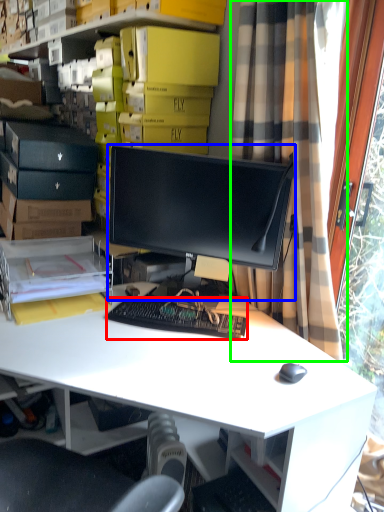
Question: Considering the real-world distances, which object is closest to computer keyboard (highlighted by a red box)? computer monitor (highlighted by a blue box) or curtain (highlighted by a green box).

Choices:
 (A) computer monitor
 (B) curtain

Answer: (A)